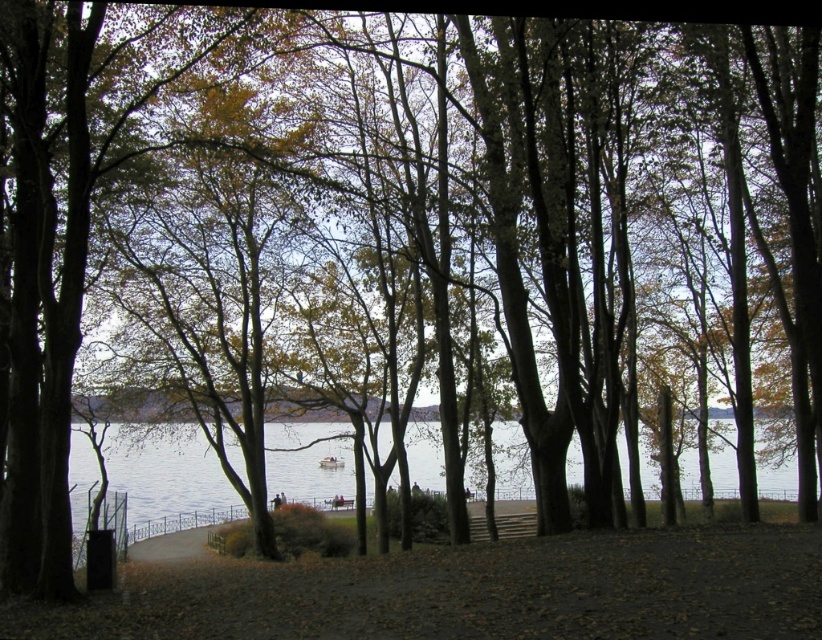
Image resolution: width=822 pixels, height=640 pixels. Describe the element at coordinates (165, 474) in the screenshot. I see `clear water at center` at that location.

Where is `clear water at center`? clear water at center is located at coordinates (165, 474).

Is point (518, 486) positioned after point (335, 456)?

No, it is in front of (335, 456).

The height and width of the screenshot is (640, 822). Identify the location of clear water at center. (165, 474).